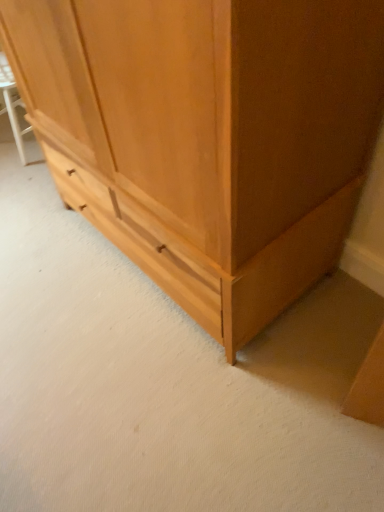
Describe the element at coordinates (209, 135) in the screenshot. I see `light wood chest of drawers at center` at that location.

Locate an element on the screen. light wood chest of drawers at center is located at coordinates (209, 135).

Looking at this image, measure the distance between point (x=127, y=217) and camera.

They are 4.80 feet apart.

What is the approximate width of light wood chest of drawers at center?

The width of light wood chest of drawers at center is 24.77 inches.

The height and width of the screenshot is (512, 384). Identify the location of light wood chest of drawers at center. [209, 135].